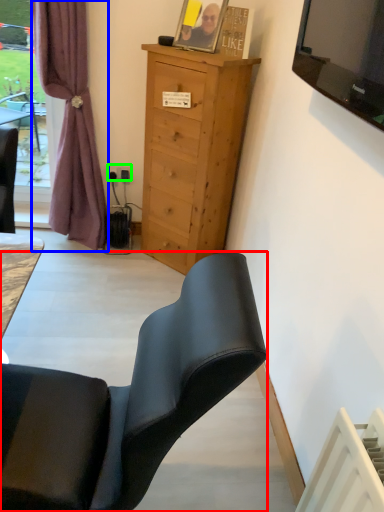
Question: Which object is the farthest from chair (highlighted by a red box)? Choose among these: curtain (highlighted by a blue box) or power outlet (highlighted by a green box).

Choices:
 (A) curtain
 (B) power outlet

Answer: (B)